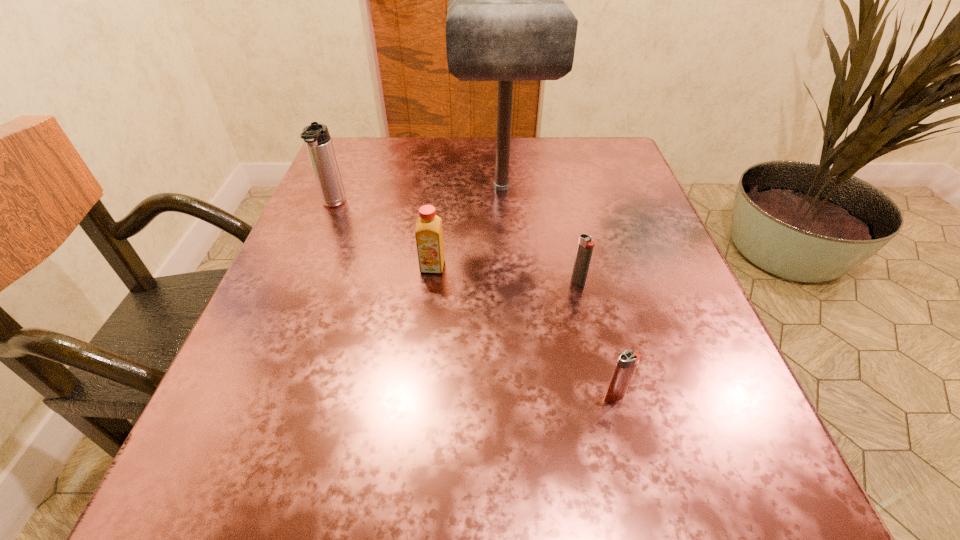
Image resolution: width=960 pixels, height=540 pixels. What are the coordinates of `vacant space located 0.100m on the front and back of the fourth object from right to left` in the screenshot? It's located at (426, 319).

Where is `vacant region located 0.130m on the front of the second nearest object`? The width and height of the screenshot is (960, 540). vacant region located 0.130m on the front of the second nearest object is located at coordinates (594, 350).

Find the location of `free space located on the right of the nearer igniter`. free space located on the right of the nearer igniter is located at coordinates (701, 395).

Locate an element on the screen. object present at the far edge is located at coordinates (507, 20).

The height and width of the screenshot is (540, 960). I want to click on object at the left edge, so [x=316, y=136].

Locate an element on the screen. This screenshot has height=540, width=960. object located at the right edge is located at coordinates (627, 361).

Locate an element on the screen. The height and width of the screenshot is (540, 960). free space at the far edge is located at coordinates (461, 187).

The width and height of the screenshot is (960, 540). In the image, there is a desktop. In order to click on blank space at the near edge in this screenshot , I will do `click(599, 475)`.

In the image, there is a desktop. Where is `vacant space at the left edge`? vacant space at the left edge is located at coordinates (292, 389).

Identify the location of free space at the right edge of the desktop. (686, 332).